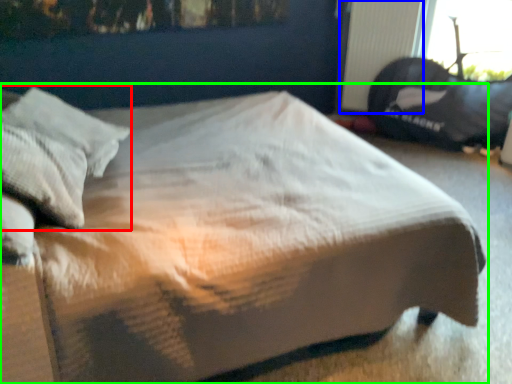
Question: Which object is positioned farthest from pillow (highlighted by a red box)? Select from radiator (highlighted by a blue box) and bed (highlighted by a green box).

Choices:
 (A) radiator
 (B) bed

Answer: (A)